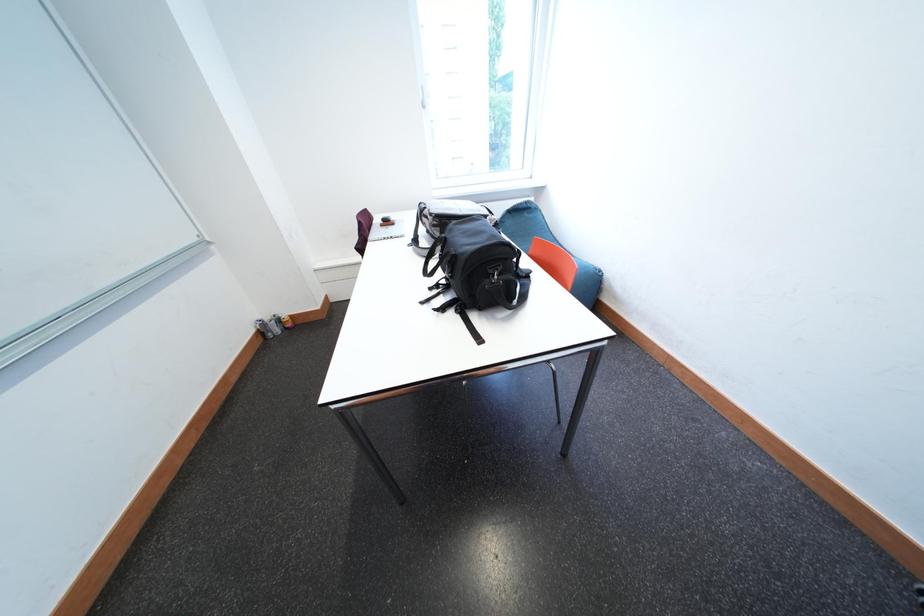
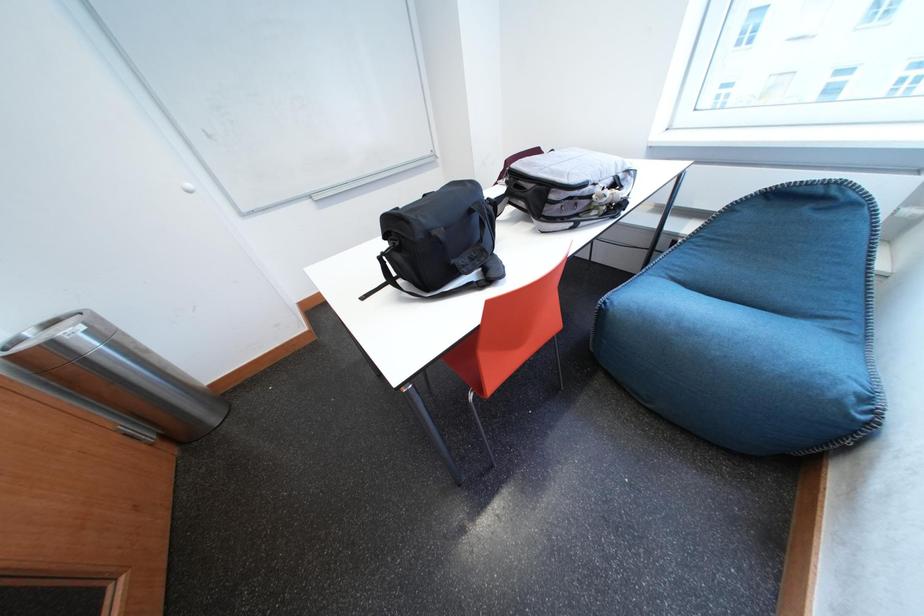
The first image is from the beginning of the video and the second image is from the end. How did the camera likely rotate when shooting the video?

The camera rotated toward left-down.